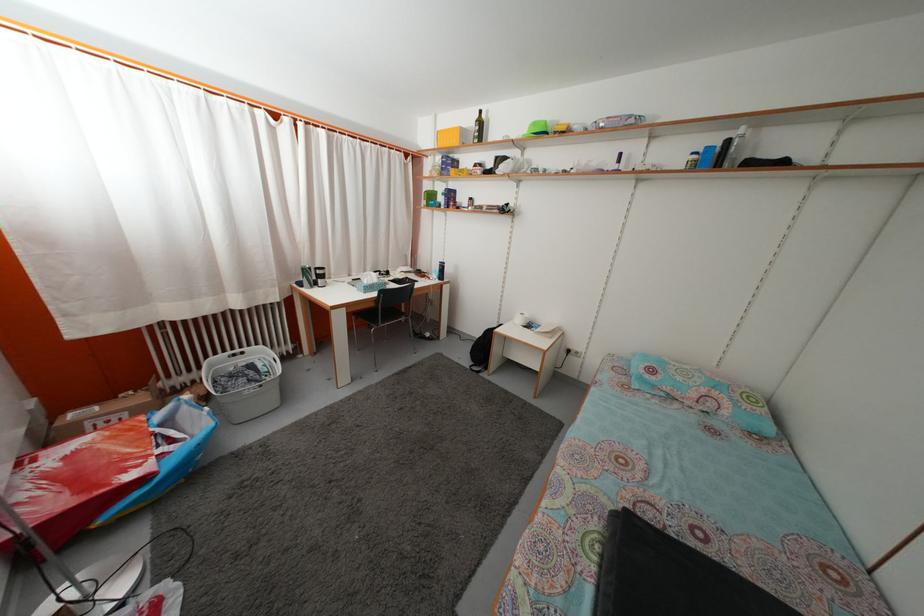
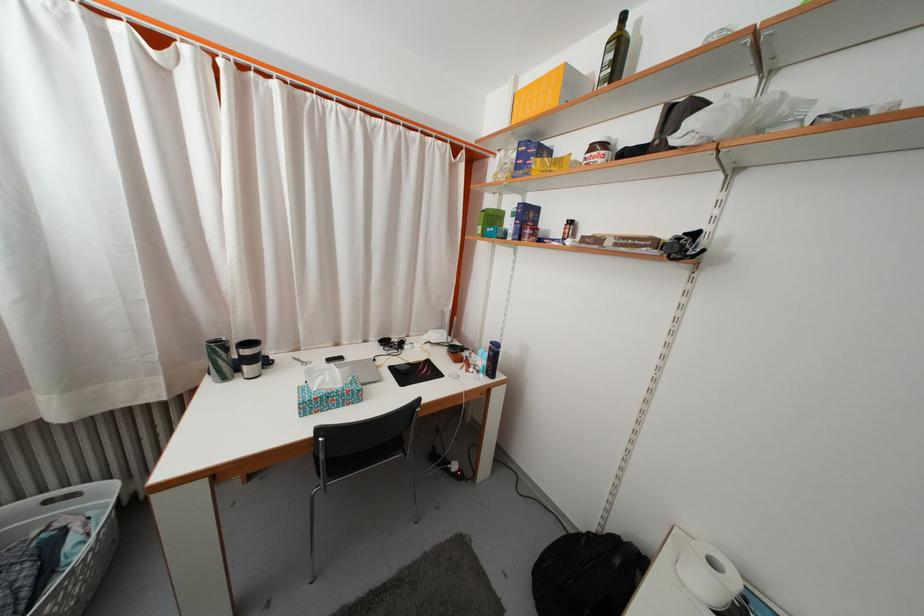
Locate, in the second image, the point that corresponds to point (310, 278) in the first image.

(225, 354)